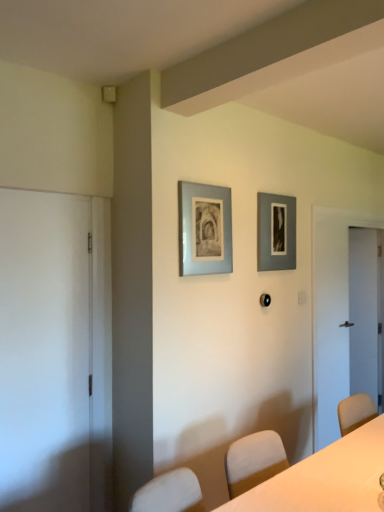
You are a GUI agent. You are given a task and a screenshot of the screen. Output one action in this format:
    pyautogui.click(x=<x>, y=<y>)
    Task: Click on the free space above white matte door at left, which is the first door from front to back (from a real-world perspective)
    The height and width of the screenshot is (512, 384).
    Given the screenshot: What is the action you would take?
    pyautogui.click(x=40, y=197)